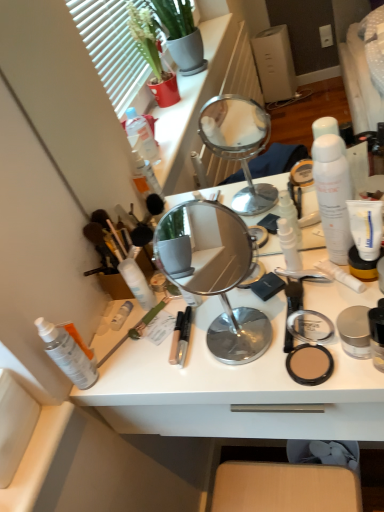
This screenshot has width=384, height=512. In order to click on vacant space that's between green matte brush at center and white matte tube at right, the second toothpaste ordered from the bottom in this screenshot , I will do `click(219, 315)`.